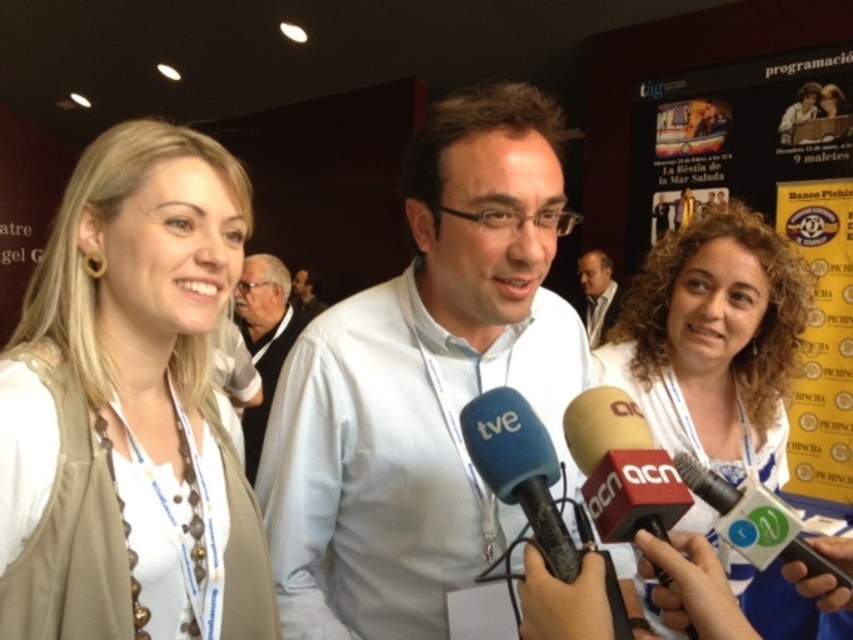
Question: Is curly hair at center closer to the viewer compared to white fabric vest at center?

Choices:
 (A) no
 (B) yes

Answer: (B)

Question: Which object is the farthest from the white fabric vest at center?

Choices:
 (A) curly hair at center
 (B) black matte microphone at center
 (C) dark brown leather jacket at center
 (D) white matte shirt at center

Answer: (B)

Question: Which object is closer to the camera taking this photo?

Choices:
 (A) beige fabric vest at left
 (B) white plastic microphone at lower right
 (C) white matte shirt at center
 (D) curly hair at center

Answer: (A)

Question: Considering the real-world distances, which object is closest to the curly hair at center?

Choices:
 (A) white plastic microphone at lower right
 (B) white matte shirt at center

Answer: (B)

Question: Is curly hair at center smaller than white plastic microphone at lower right?

Choices:
 (A) no
 (B) yes

Answer: (A)

Question: Where is white matte shirt at center located in relation to black matte microphone at center in the image?

Choices:
 (A) above
 (B) below

Answer: (A)